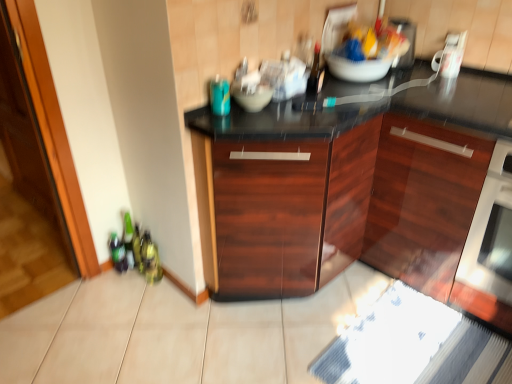
This screenshot has width=512, height=384. What do you see at coordinates (450, 55) in the screenshot?
I see `white glossy toaster at upper right` at bounding box center [450, 55].

The width and height of the screenshot is (512, 384). Describe the element at coordinates (362, 188) in the screenshot. I see `dark wood cabinet at center, acting as the 2th cabinetry starting from the left` at that location.

What do you see at coordinates (282, 210) in the screenshot? The height and width of the screenshot is (384, 512). I see `mahogany wood cabinet at center, the second cabinetry when ordered from right to left` at bounding box center [282, 210].

This screenshot has height=384, width=512. What are the coordinates of `satin white oven at right` in the screenshot? It's located at coord(490,232).

You are a GUI agent. You are given a task and a screenshot of the screen. Output one action in this format:
    pyautogui.click(x=<x>, y=<y>)
    Task: Click on the teal glass bottle at upper center
    The height and width of the screenshot is (384, 512).
    Given the screenshot: What is the action you would take?
    pyautogui.click(x=220, y=96)

The width and height of the screenshot is (512, 384). I want to click on matte gray bowl at center, so click(253, 97).

Identify the location of white glossy toaster at upper right. Image resolution: width=512 pixels, height=384 pixels. (450, 55).

From a real-world perspective, is matte gray bowl at center located higher than teal glass bottle at upper center?

No, from a real-world perspective, matte gray bowl at center is not above teal glass bottle at upper center.

From the image's perspective, is matte gray bowl at center above or below teal glass bottle at upper center?

matte gray bowl at center is above teal glass bottle at upper center.

Which is more to the left, matte gray bowl at center or teal glass bottle at upper center?

teal glass bottle at upper center is more to the left.

Is matte gray bowl at center next to teal glass bottle at upper center and touching it?

Yes, matte gray bowl at center is in contact with teal glass bottle at upper center.

Is mahogany wood cabinet at center, the second cabinetry when ordered from right to left, oriented away from satin white oven at right?

No, mahogany wood cabinet at center, the second cabinetry when ordered from right to left,'s orientation is not away from satin white oven at right.

Are mahogany wood cabinet at center, the 1th cabinetry positioned from the left, and satin white oven at right beside each other?

No, mahogany wood cabinet at center, the 1th cabinetry positioned from the left, is not in contact with satin white oven at right.

How distant is mahogany wood cabinet at center, the 1th cabinetry positioned from the left, from satin white oven at right?

24.76 inches.

Where is `oven that appears below the mahogany wood cabinet at center, the 1th cabinetry positioned from the left (from the image's perspective)`? The width and height of the screenshot is (512, 384). oven that appears below the mahogany wood cabinet at center, the 1th cabinetry positioned from the left (from the image's perspective) is located at coordinates (490, 232).

Are transparent glass door at left and teal glass bottle at upper center located far from each other?

Yes, transparent glass door at left is far from teal glass bottle at upper center.

The height and width of the screenshot is (384, 512). Find the location of `glass door on the left of the teal glass bottle at upper center`. glass door on the left of the teal glass bottle at upper center is located at coordinates (27, 193).

Consider the image. Considering the sizes of objects transparent glass door at left and teal glass bottle at upper center in the image provided, who is wider, transparent glass door at left or teal glass bottle at upper center?

Wider between the two is transparent glass door at left.

Which is behind, point (455, 67) or point (268, 93)?

Point (455, 67)

Does white glossy toaster at upper right touch matte gray bowl at center?

They are not placed beside each other.

Does white glossy toaster at upper right have a larger size compared to matte gray bowl at center?

Incorrect, white glossy toaster at upper right is not larger than matte gray bowl at center.

Which object is closer to the camera taking this photo, mahogany wood cabinet at center, the second cabinetry when ordered from right to left, or dark wood cabinet at center, placed as the first cabinetry when sorted from right to left?

dark wood cabinet at center, placed as the first cabinetry when sorted from right to left, is more forward.

Who is taller, mahogany wood cabinet at center, the second cabinetry when ordered from right to left, or dark wood cabinet at center, acting as the 2th cabinetry starting from the left?

With more height is dark wood cabinet at center, acting as the 2th cabinetry starting from the left.

Is dark wood cabinet at center, acting as the 2th cabinetry starting from the left, a part of mahogany wood cabinet at center, the second cabinetry when ordered from right to left?

No.

Considering the relative sizes of satin white oven at right and mahogany wood cabinet at center, the second cabinetry when ordered from right to left, in the image provided, is satin white oven at right bigger than mahogany wood cabinet at center, the second cabinetry when ordered from right to left,?

No, satin white oven at right is not bigger than mahogany wood cabinet at center, the second cabinetry when ordered from right to left.

From the picture: In the image, is satin white oven at right on the left side or the right side of mahogany wood cabinet at center, the second cabinetry when ordered from right to left?

In the image, satin white oven at right appears on the right side of mahogany wood cabinet at center, the second cabinetry when ordered from right to left.

From the image's perspective, which is above, satin white oven at right or mahogany wood cabinet at center, the second cabinetry when ordered from right to left?

mahogany wood cabinet at center, the second cabinetry when ordered from right to left.

Would you say satin white oven at right is outside mahogany wood cabinet at center, the second cabinetry when ordered from right to left?

That's correct, satin white oven at right is outside of mahogany wood cabinet at center, the second cabinetry when ordered from right to left.

Does dark wood cabinet at center, placed as the first cabinetry when sorted from right to left, have a lesser height compared to satin white oven at right?

In fact, dark wood cabinet at center, placed as the first cabinetry when sorted from right to left, may be taller than satin white oven at right.

Which is in front, point (440, 93) or point (499, 180)?

The point (499, 180) is closer to the camera.

Is dark wood cabinet at center, placed as the first cabinetry when sorted from right to left, oriented away from satin white oven at right?

No, dark wood cabinet at center, placed as the first cabinetry when sorted from right to left, is not facing the opposite direction of satin white oven at right.

Is dark wood cabinet at center, acting as the 2th cabinetry starting from the left, outside of satin white oven at right?

Indeed, dark wood cabinet at center, acting as the 2th cabinetry starting from the left, is completely outside satin white oven at right.

This screenshot has height=384, width=512. Find the location of `bowl lying behind the teal glass bottle at upper center`. bowl lying behind the teal glass bottle at upper center is located at coordinates (253, 97).

Find the location of a particular element. The width and height of the screenshot is (512, 384). oven that is under the mahogany wood cabinet at center, the second cabinetry when ordered from right to left (from a real-world perspective) is located at coordinates (490, 232).

When comparing their distances from mahogany wood cabinet at center, the second cabinetry when ordered from right to left, does teal glass bottle at upper center or transparent glass door at left seem closer?

The object closer to mahogany wood cabinet at center, the second cabinetry when ordered from right to left, is teal glass bottle at upper center.

From the image, which object appears to be farther from satin white oven at right, dark wood cabinet at center, acting as the 2th cabinetry starting from the left, or mahogany wood cabinet at center, the second cabinetry when ordered from right to left?

The object further to satin white oven at right is mahogany wood cabinet at center, the second cabinetry when ordered from right to left.

Based on their spatial positions, is mahogany wood cabinet at center, the second cabinetry when ordered from right to left, or satin white oven at right closer to dark wood cabinet at center, placed as the first cabinetry when sorted from right to left?

The object closer to dark wood cabinet at center, placed as the first cabinetry when sorted from right to left, is mahogany wood cabinet at center, the second cabinetry when ordered from right to left.

Considering their positions, is dark wood cabinet at center, placed as the first cabinetry when sorted from right to left, positioned further to mahogany wood cabinet at center, the second cabinetry when ordered from right to left, than white glossy toaster at upper right?

The object further to mahogany wood cabinet at center, the second cabinetry when ordered from right to left, is white glossy toaster at upper right.

From the image, which object appears to be nearer to satin white oven at right, matte gray bowl at center or white glossy toaster at upper right?

Among the two, white glossy toaster at upper right is located nearer to satin white oven at right.

In the scene shown: Estimate the real-world distances between objects in this image. Which object is further from dark wood cabinet at center, acting as the 2th cabinetry starting from the left, mahogany wood cabinet at center, the 1th cabinetry positioned from the left, or white glossy toaster at upper right?

white glossy toaster at upper right is positioned further to the anchor dark wood cabinet at center, acting as the 2th cabinetry starting from the left.

Looking at the image, which one is located closer to white glossy toaster at upper right, mahogany wood cabinet at center, the second cabinetry when ordered from right to left, or teal glass bottle at upper center?

mahogany wood cabinet at center, the second cabinetry when ordered from right to left.

Based on their spatial positions, is dark wood cabinet at center, placed as the first cabinetry when sorted from right to left, or white glossy toaster at upper right closer to transparent glass door at left?

dark wood cabinet at center, placed as the first cabinetry when sorted from right to left.

This screenshot has width=512, height=384. Find the location of `cabinetry located between matte gray bowl at center and dark wood cabinet at center, placed as the first cabinetry when sorted from right to left, in the left-right direction`. cabinetry located between matte gray bowl at center and dark wood cabinet at center, placed as the first cabinetry when sorted from right to left, in the left-right direction is located at coordinates (282, 210).

Identify the location of bottle located between transparent glass door at left and mahogany wood cabinet at center, the second cabinetry when ordered from right to left, in the left-right direction. The width and height of the screenshot is (512, 384). (220, 96).

At what (x,y) coordinates should I click in order to perform the action: click on bottle located between transparent glass door at left and matte gray bowl at center in the left-right direction. Please return your answer as a coordinate pair (x, y). Looking at the image, I should click on [x=220, y=96].

The image size is (512, 384). I want to click on cabinetry between transparent glass door at left and dark wood cabinet at center, acting as the 2th cabinetry starting from the left, from left to right, so click(282, 210).